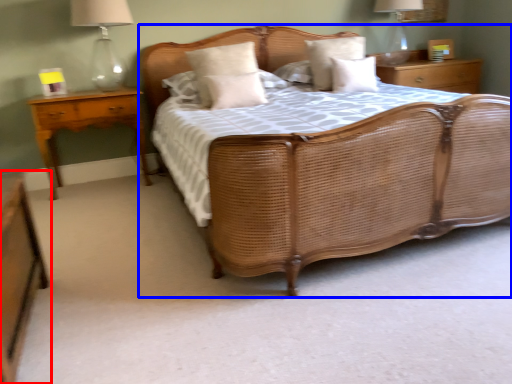
Question: Which of the following is the closest to the observer, nightstand (highlighted by a red box) or bed (highlighted by a blue box)?

Choices:
 (A) nightstand
 (B) bed

Answer: (A)